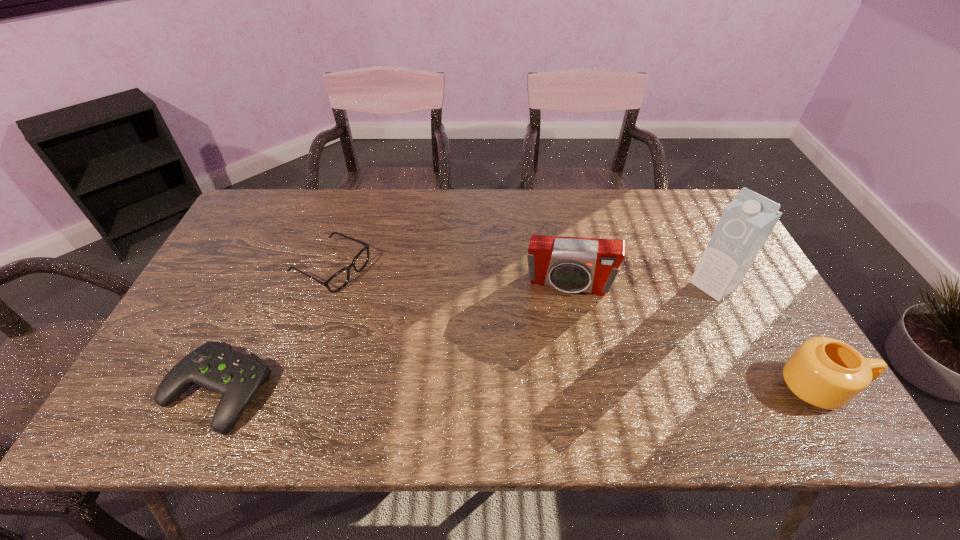
Identify the location of control. This screenshot has width=960, height=540. (215, 366).

The image size is (960, 540). Identify the location of mug. point(825,372).

This screenshot has width=960, height=540. What are the coordinates of `the tallest object` in the screenshot? It's located at pyautogui.click(x=746, y=223).

Where is `camera`? The height and width of the screenshot is (540, 960). camera is located at coordinates (570, 264).

Find the location of a particular element. the third object from right to left is located at coordinates (570, 264).

Identify the location of spectacles. (339, 280).

Locate an element on the screen. The height and width of the screenshot is (540, 960). vacant space situated on the right of the control is located at coordinates (422, 391).

Where is `vacant space located 0.330m on the front label of the carton`? This screenshot has height=540, width=960. vacant space located 0.330m on the front label of the carton is located at coordinates (618, 356).

I want to click on vacant space located on the front label of the carton, so click(678, 312).

At what (x,y) coordinates should I click in order to perform the action: click on free space located on the front label of the carton. Please return your answer as a coordinate pair (x, y). Looking at the image, I should click on (637, 342).